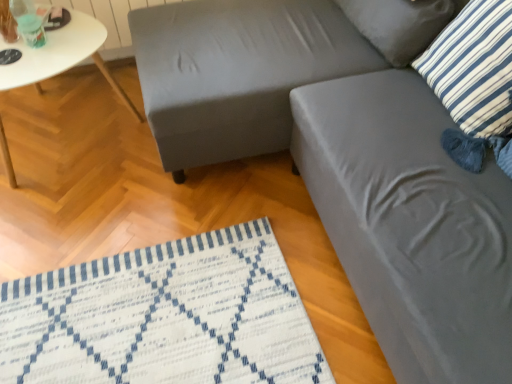
The width and height of the screenshot is (512, 384). Find the location of `vacant space in front of white glossy table at left`. vacant space in front of white glossy table at left is located at coordinates (78, 225).